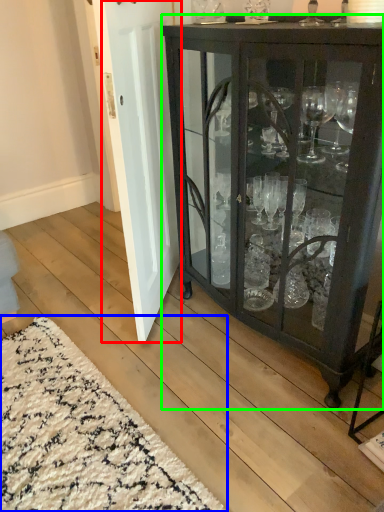
Question: Which object is the farthest from door (highlighted by a red box)? Choose among these: doormat (highlighted by a blue box) or cupboard (highlighted by a green box).

Choices:
 (A) doormat
 (B) cupboard

Answer: (A)